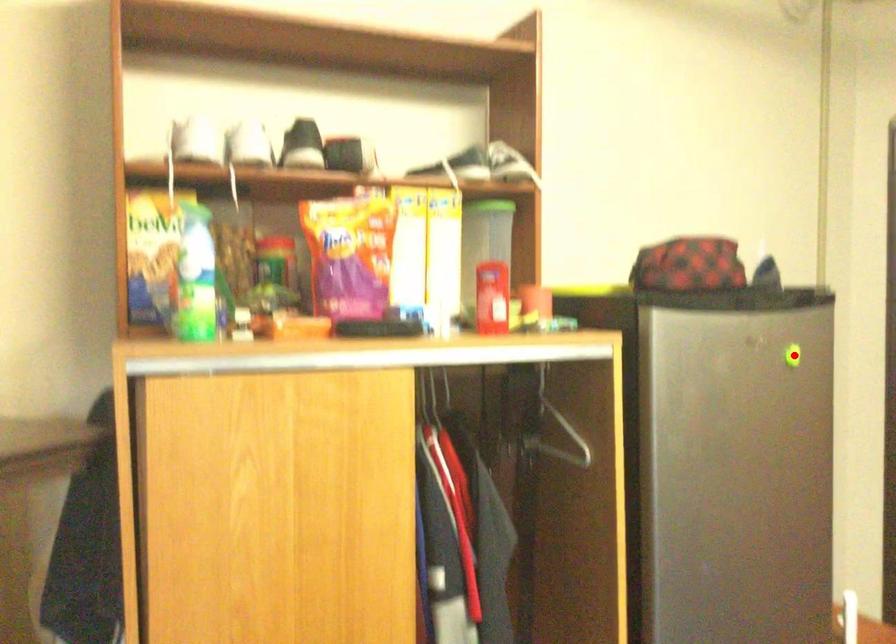
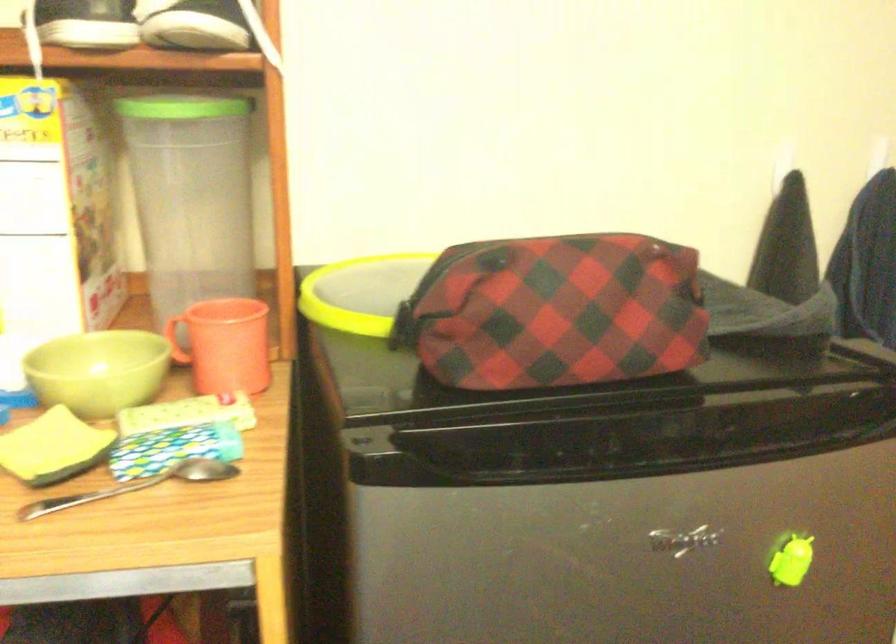
Question: I am providing you with two images of the same scene from different viewpoints. A red point is shown in image1. For the corresponding object point in image2, is it positioned nearer or farther from the camera?

Choices:
 (A) Nearer
 (B) Farther

Answer: (A)